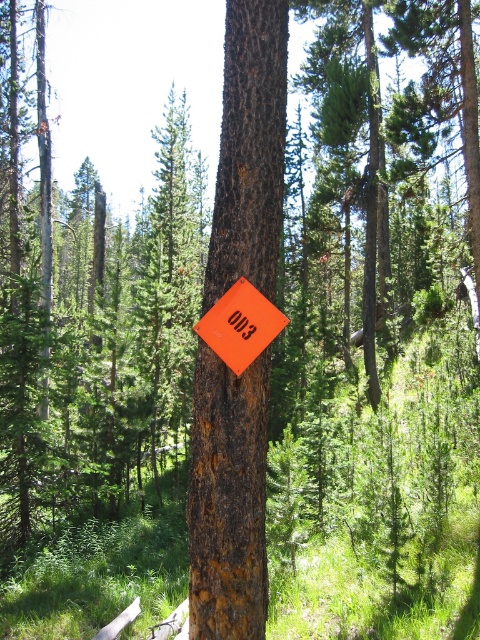
Question: Does rusty bark tree trunk at center appear under orange matte sign at center?

Choices:
 (A) no
 (B) yes

Answer: (A)

Question: Is rusty bark tree trunk at center further to camera compared to orange matte sign at center?

Choices:
 (A) yes
 (B) no

Answer: (A)

Question: Among these points, which one is nearest to the camera?

Choices:
 (A) (239, 371)
 (B) (223, 424)

Answer: (A)

Question: Is rusty bark tree trunk at center to the left of orange matte sign at center from the viewer's perspective?

Choices:
 (A) yes
 (B) no

Answer: (A)